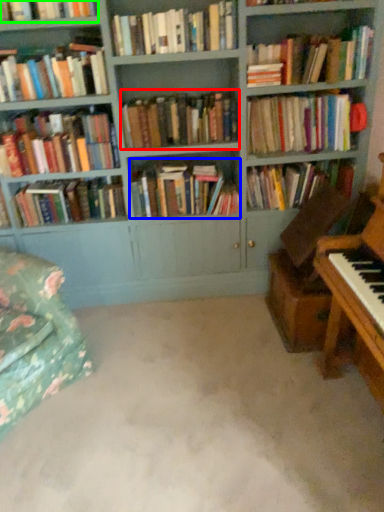
Question: Considering the real-world distances, which object is farthest from book (highlighted by a red box)? book (highlighted by a blue box) or book (highlighted by a green box)?

Choices:
 (A) book
 (B) book

Answer: (B)